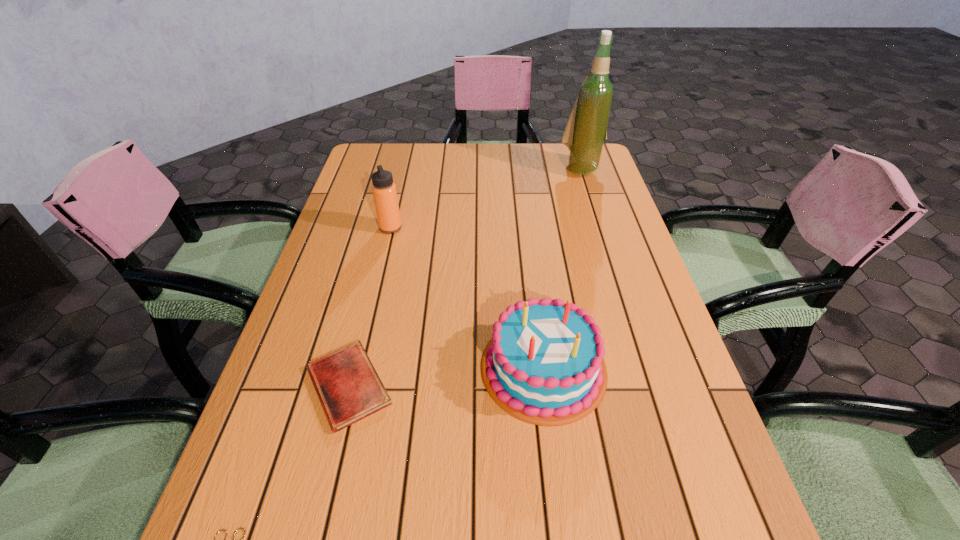
Locate an element on the screen. The width and height of the screenshot is (960, 540). the rightmost object is located at coordinates (586, 130).

I want to click on the farthest object, so [586, 130].

I want to click on the second tallest object, so click(x=384, y=191).

Where is `thermos bottle`? This screenshot has height=540, width=960. thermos bottle is located at coordinates (384, 191).

Locate an element on the screen. the third tallest object is located at coordinates (544, 365).

Where is `the second object from right to left`? the second object from right to left is located at coordinates (544, 365).

Find the location of a particular element. The height and width of the screenshot is (540, 960). the fourth tallest object is located at coordinates (349, 389).

Locate an element on the screen. vacant space located 0.110m on the front-facing side of the wine bottle is located at coordinates (590, 200).

This screenshot has height=540, width=960. What are the coordinates of `free spot located on the right of the second farthest object` in the screenshot? It's located at (438, 228).

At what (x,y) coordinates should I click in order to perform the action: click on free space located on the front of the birthday cake. Please return your answer as a coordinate pair (x, y). The height and width of the screenshot is (540, 960). Looking at the image, I should click on click(x=557, y=478).